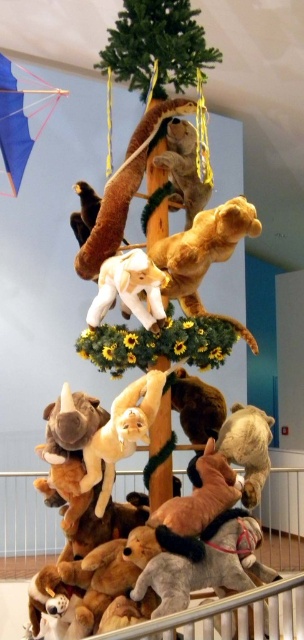
Is green matte tree at upper center thinner than brown plush monkey at center?

No.

Image resolution: width=304 pixels, height=640 pixels. Identify the location of green matte tree at upper center. coord(156,45).

Who is more distant from viewer, (169,68) or (197,403)?

Point (197,403)

At what (x,y) coordinates should I click in order to perform the action: click on green matte tree at upper center. Please return your answer as a coordinate pair (x, y). This screenshot has height=640, width=304. Looking at the image, I should click on (156, 45).

Does soft brown teddy bear at center appear over blue fabric kite at upper left?

Incorrect, soft brown teddy bear at center is not positioned above blue fabric kite at upper left.

Who is positioned more to the right, soft brown teddy bear at center or blue fabric kite at upper left?

Positioned to the right is soft brown teddy bear at center.

Based on the photo, who is more distant from viewer, (197, 230) or (20, 76)?

The point (20, 76) is more distant.

This screenshot has height=640, width=304. I want to click on soft brown teddy bear at center, so click(x=204, y=256).

Is point (162, 257) positioned in front of point (76, 253)?

Yes, it is.

Between point (178, 276) and point (109, 220), which one is positioned in front?

Positioned in front is point (178, 276).

Is point (225, 244) closer to viewer compared to point (86, 253)?

Yes.

This screenshot has width=304, height=640. What are the coordinates of `soft brown teddy bear at center` in the screenshot? It's located at [204, 256].